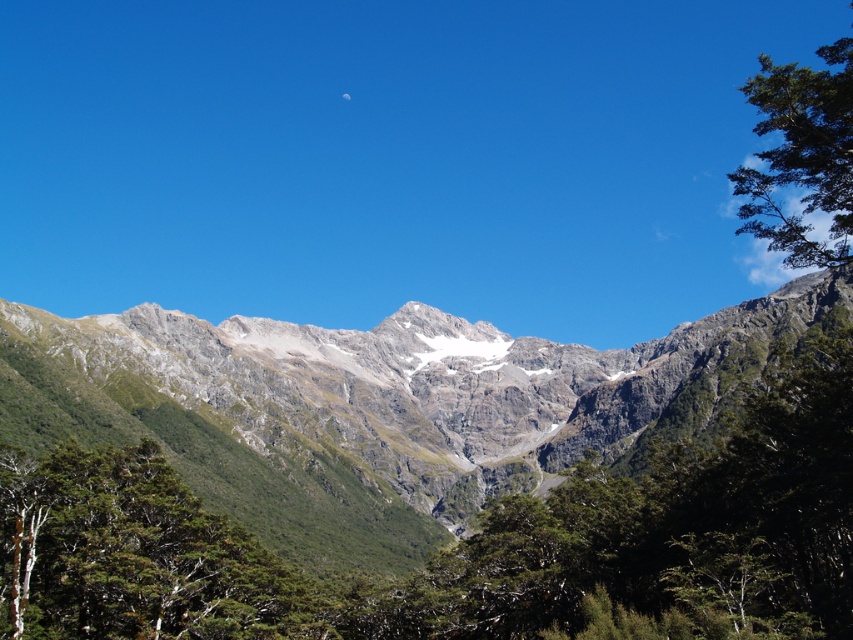
Question: Which of the following is the farthest from the observer?

Choices:
 (A) (160, 544)
 (B) (784, 97)
 (C) (354, 381)

Answer: (C)

Question: Can you confirm if green leafy tree at lower left is positioned above green leafy tree at upper right?

Choices:
 (A) yes
 (B) no

Answer: (B)

Question: Can you confirm if rugged granite mountain range at center is positioned above green leafy tree at upper right?

Choices:
 (A) no
 (B) yes

Answer: (A)

Question: Which point is closer to the camera taking this photo?

Choices:
 (A) (273, 563)
 (B) (798, 160)

Answer: (B)

Question: Which object is closer to the camera taking this photo?

Choices:
 (A) green leafy tree at lower left
 (B) rugged granite mountain range at center
 (C) green leafy tree at upper right

Answer: (C)

Question: Is rugged granite mountain range at center above green leafy tree at lower left?

Choices:
 (A) no
 (B) yes

Answer: (B)